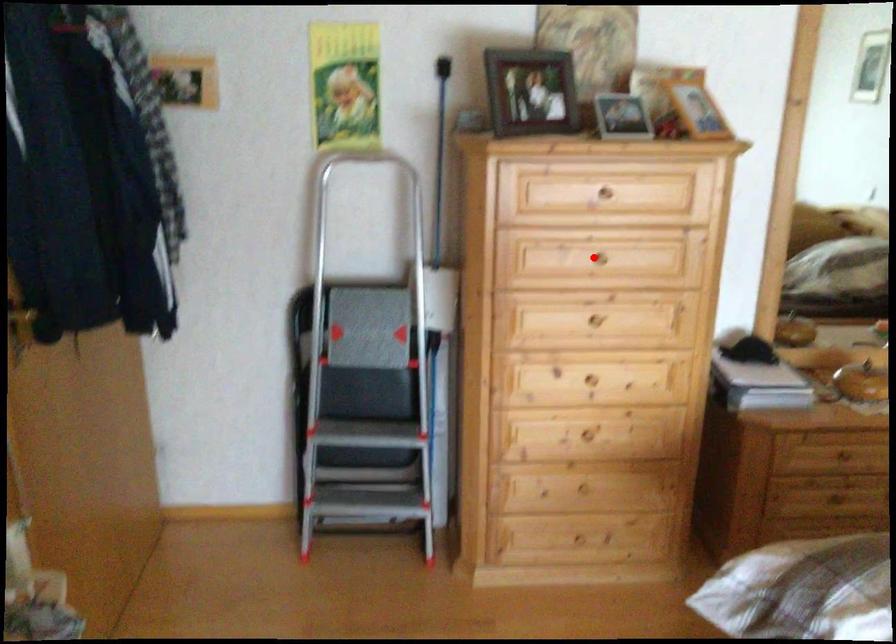
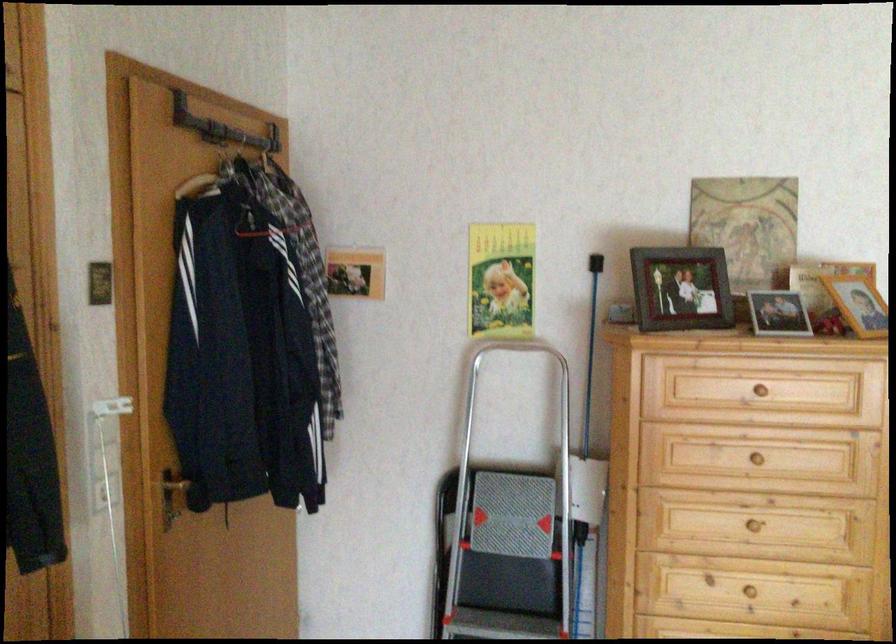
Where in the second image is the point corresponding to the highlighted location from the first image?

(754, 456)